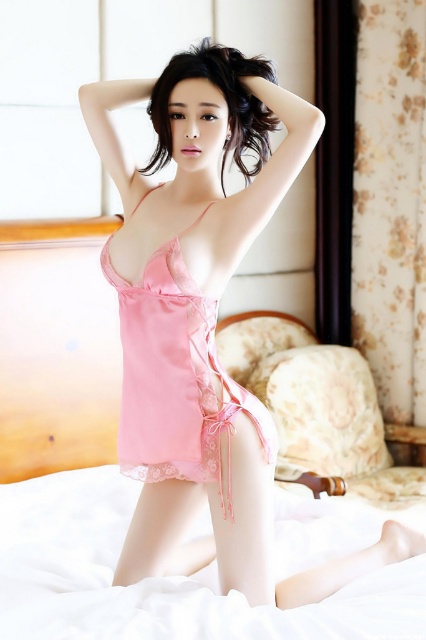
You are a fashion stylist preparing for a photoshoot. You have two options for the model to wear in the same scene on the bed. The model is currently wearing the matte pink lingerie at center. The photoshoot requires the outfit to be lower on the bed to capture the flow of the fabric. Should the model switch to the pink satin dress at center instead?

The matte pink lingerie at center is above the pink satin dress at center. To have the outfit lower on the bed for the photoshoot, the model should switch to the pink satin dress at center since it is positioned lower.

You are a photographer setting up a shoot in this bedroom scene. You need to adjust the lighting so that the matte pink lingerie at center is more prominently lit than the sleek black hair at upper center. Since the lighting is currently natural, which object should you focus the light on and why?

The matte pink lingerie at center is further to the viewer than the sleek black hair at upper center, so you should focus the light on the matte pink lingerie at center to ensure it stands out more prominently in the composition.

You are a fashion designer looking at the image of a model wearing two pink outfits. The model is standing on a bed with white sheets. You need to determine the spatial relationship between the matte pink lingerie at center and the pink satin dress at center. Which one is located to the left?

The matte pink lingerie at center is positioned on the right side of the pink satin dress at center, so the pink satin dress at center is to the left of the matte pink lingerie at center.